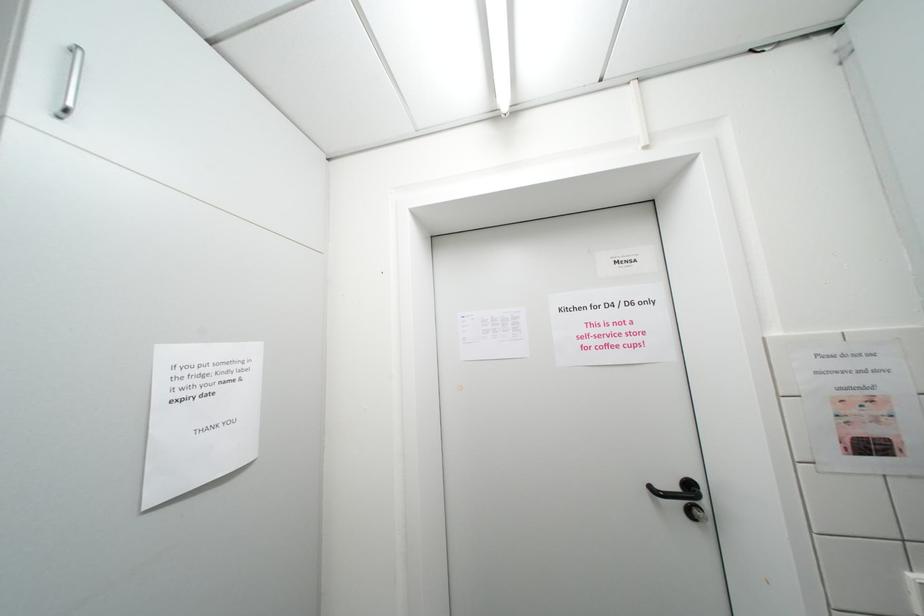
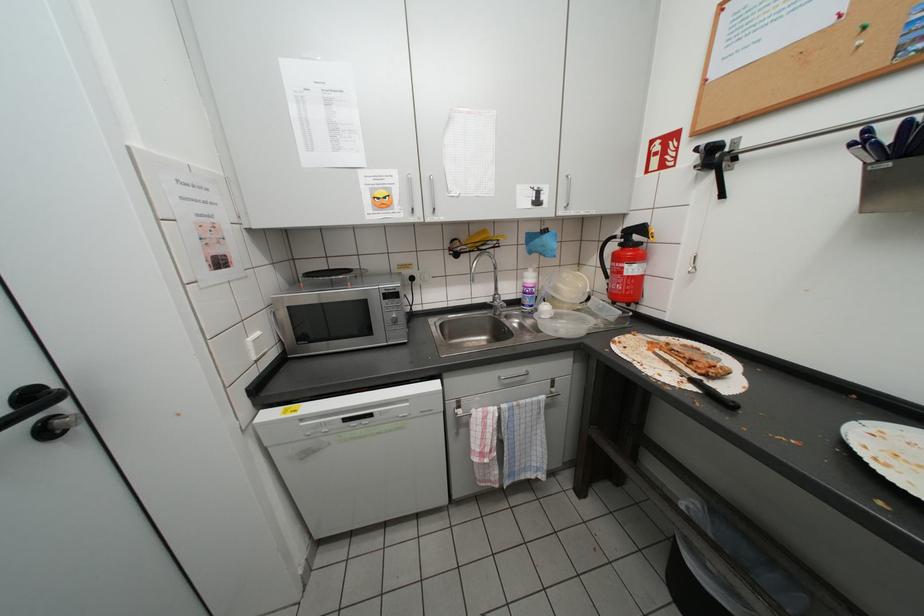
Question: The camera is either moving clockwise (left) or counter-clockwise (right) around the object. The first image is from the beginning of the video and the second image is from the end. Is the camera moving left or right when shooting the video?

Choices:
 (A) Left
 (B) Right

Answer: (A)